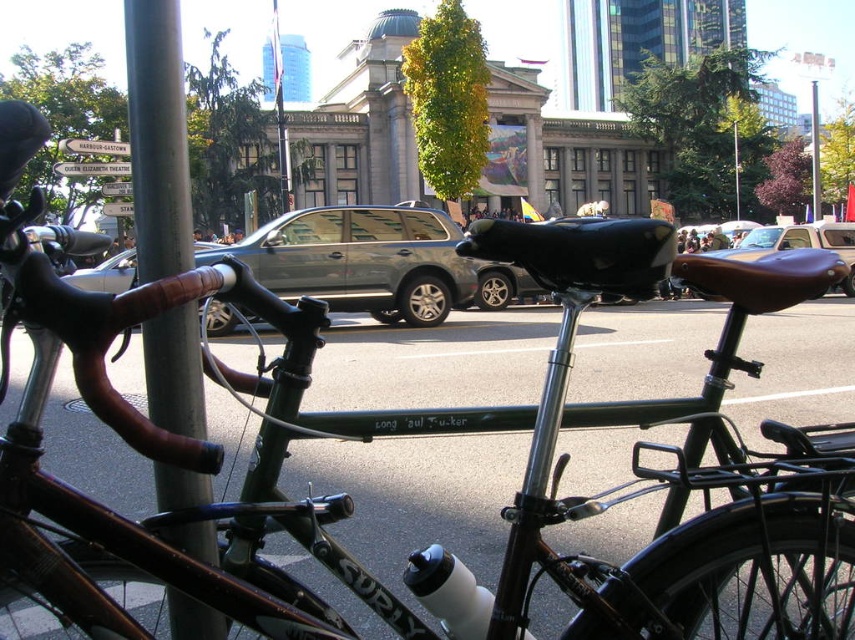
Question: Estimate the real-world distances between objects in this image. Which object is closer to the silver metallic pole at left?

Choices:
 (A) brushed metal pole at center
 (B) brown leather seat at center

Answer: (B)

Question: Among these objects, which one is farthest from the camera?

Choices:
 (A) metallic gray suv at center
 (B) brushed metal pole at center

Answer: (B)

Question: Can you confirm if metallic gray suv at center is thinner than brushed metal pole at center?

Choices:
 (A) yes
 (B) no

Answer: (A)

Question: From the image, what is the correct spatial relationship of brown leather seat at center in relation to brushed metal pole at center?

Choices:
 (A) below
 (B) above

Answer: (A)

Question: Which is nearer to the brown leather seat at center?

Choices:
 (A) metallic gray suv at center
 (B) brushed metal pole at center
 (C) silver metallic pole at left

Answer: (A)

Question: Where is silver metallic pole at left located in relation to brushed metal pole at center in the image?

Choices:
 (A) left
 (B) right

Answer: (A)